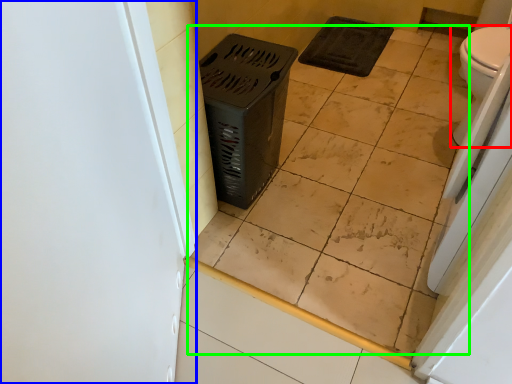
Question: Considering the real-world distances, which object is closest to toilet (highlighted by a red box)? screen door (highlighted by a blue box) or ceramic tile (highlighted by a green box).

Choices:
 (A) screen door
 (B) ceramic tile

Answer: (B)